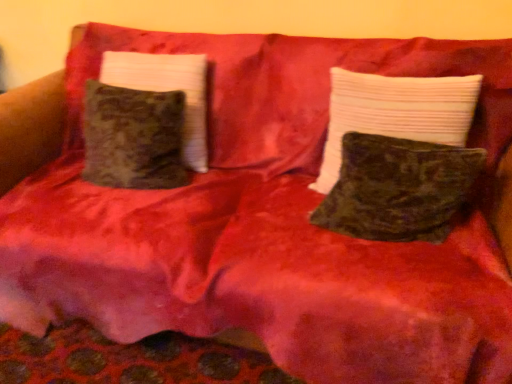
Question: Is velvet green pillow at center, the third pillow viewed from the left, in contact with velvet green pillow at left, the third pillow from the right?

Choices:
 (A) yes
 (B) no

Answer: (B)

Question: Does velvet green pillow at center, which ranks as the first pillow in right-to-left order, have a greater height compared to velvet green pillow at left, the third pillow from the right?

Choices:
 (A) yes
 (B) no

Answer: (B)

Question: From the image's perspective, is velvet green pillow at center, which ranks as the first pillow in right-to-left order, under velvet green pillow at left, the third pillow from the right?

Choices:
 (A) no
 (B) yes

Answer: (B)

Question: From a real-world perspective, is velvet green pillow at center, the third pillow viewed from the left, located higher than velvet green pillow at left, the first pillow in the left-to-right sequence?

Choices:
 (A) no
 (B) yes

Answer: (A)

Question: Is velvet green pillow at center, which ranks as the first pillow in right-to-left order, to the right of velvet green pillow at left, the third pillow from the right, from the viewer's perspective?

Choices:
 (A) yes
 (B) no

Answer: (A)

Question: From a real-world perspective, is velvety dark green pillow at center, marked as the second pillow in a left-to-right arrangement, physically located above or below velvet green pillow at left, the third pillow from the right?

Choices:
 (A) below
 (B) above

Answer: (A)

Question: Is velvety dark green pillow at center, marked as the second pillow in a left-to-right arrangement, bigger or smaller than velvet green pillow at left, the third pillow from the right?

Choices:
 (A) small
 (B) big

Answer: (A)

Question: Is velvety dark green pillow at center, marked as the second pillow in a left-to-right arrangement, inside the boundaries of velvet green pillow at left, the third pillow from the right, or outside?

Choices:
 (A) outside
 (B) inside

Answer: (A)

Question: From the image's perspective, is velvety dark green pillow at center, marked as the second pillow in a left-to-right arrangement, above or below velvet green pillow at left, the third pillow from the right?

Choices:
 (A) below
 (B) above

Answer: (A)

Question: From a real-world perspective, is velvety dark green pillow at center, marked as the second pillow in a left-to-right arrangement, positioned above or below velvet green pillow at center, the third pillow viewed from the left?

Choices:
 (A) below
 (B) above

Answer: (A)

Question: Is velvety dark green pillow at center, placed as the second pillow when sorted from right to left, inside or outside of velvet green pillow at center, which ranks as the first pillow in right-to-left order?

Choices:
 (A) outside
 (B) inside

Answer: (B)

Question: In terms of height, does velvety dark green pillow at center, placed as the second pillow when sorted from right to left, look taller or shorter compared to velvet green pillow at center, the third pillow viewed from the left?

Choices:
 (A) short
 (B) tall

Answer: (A)

Question: In terms of size, does velvety dark green pillow at center, placed as the second pillow when sorted from right to left, appear bigger or smaller than velvet green pillow at center, which ranks as the first pillow in right-to-left order?

Choices:
 (A) small
 (B) big

Answer: (A)

Question: Considering the positions of velvet green pillow at center, the third pillow viewed from the left, and velvety dark green pillow at center, placed as the second pillow when sorted from right to left, in the image, is velvet green pillow at center, the third pillow viewed from the left, bigger or smaller than velvety dark green pillow at center, placed as the second pillow when sorted from right to left,?

Choices:
 (A) big
 (B) small

Answer: (A)

Question: Is velvet green pillow at center, which ranks as the first pillow in right-to-left order, inside or outside of velvety dark green pillow at center, marked as the second pillow in a left-to-right arrangement?

Choices:
 (A) outside
 (B) inside

Answer: (A)